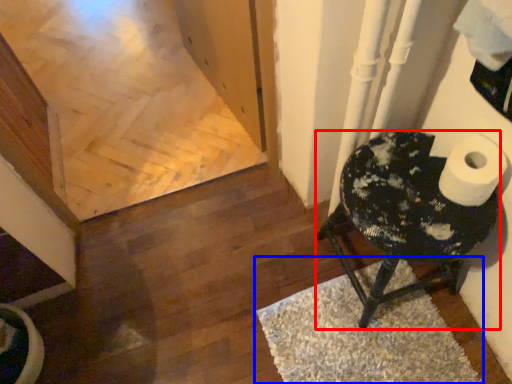
Question: Among these objects, which one is farthest to the camera, furniture (highlighted by a red box) or doormat (highlighted by a blue box)?

Choices:
 (A) furniture
 (B) doormat

Answer: (B)